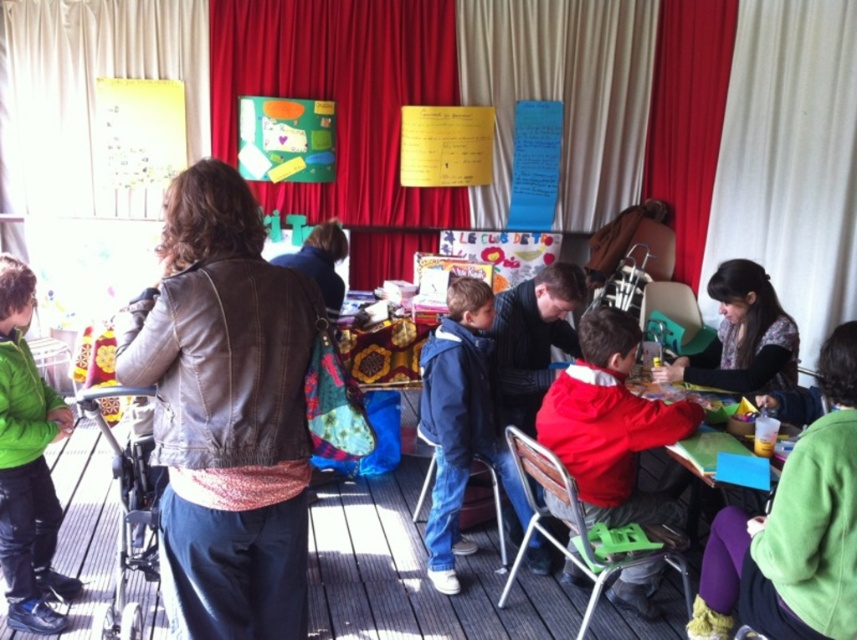
Question: Among these objects, which one is nearest to the camera?

Choices:
 (A) green puffy jacket at lower left
 (B) matte green fabric bulletin board at upper center
 (C) white fabric curtain at upper center
 (D) red matte jacket at center

Answer: (D)

Question: Which is nearer to the red matte jacket at center?

Choices:
 (A) wooden chair at lower center
 (B) white fabric curtain at upper center
 (C) green puffy jacket at lower left
 (D) leather jacket at upper left

Answer: (A)

Question: Which point is closer to the camera taking this photo?

Choices:
 (A) (673, 353)
 (B) (49, 422)
 (C) (501, 536)
 (D) (258, 156)

Answer: (B)

Question: Is green fleece jacket at lower right smaller than red matte jacket at center?

Choices:
 (A) no
 (B) yes

Answer: (B)

Question: Can you confirm if leather jacket at center is positioned to the right of dark brown leather jacket at lower right?

Choices:
 (A) yes
 (B) no

Answer: (B)

Question: Does green fleece jacket at lower right have a larger size compared to dark brown leather jacket at lower right?

Choices:
 (A) no
 (B) yes

Answer: (A)